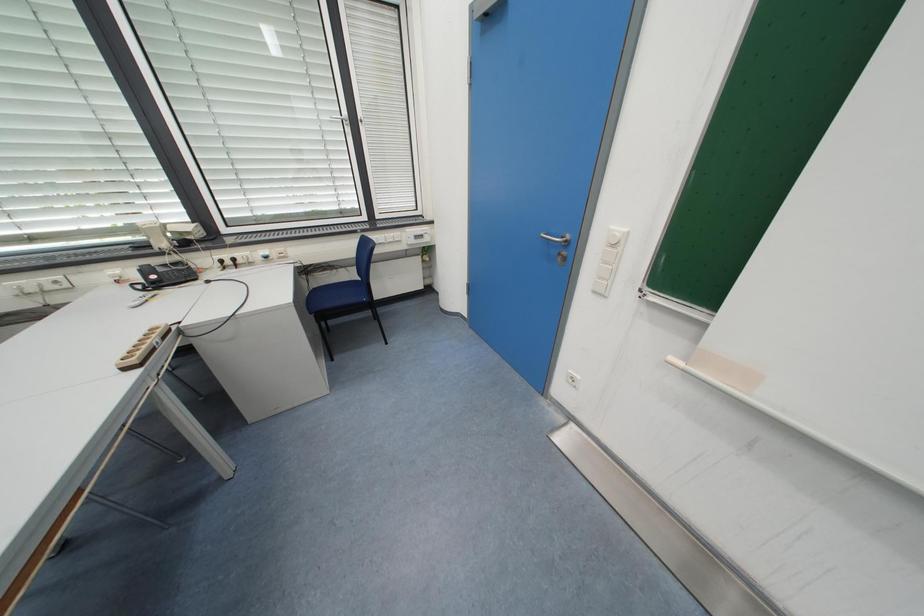
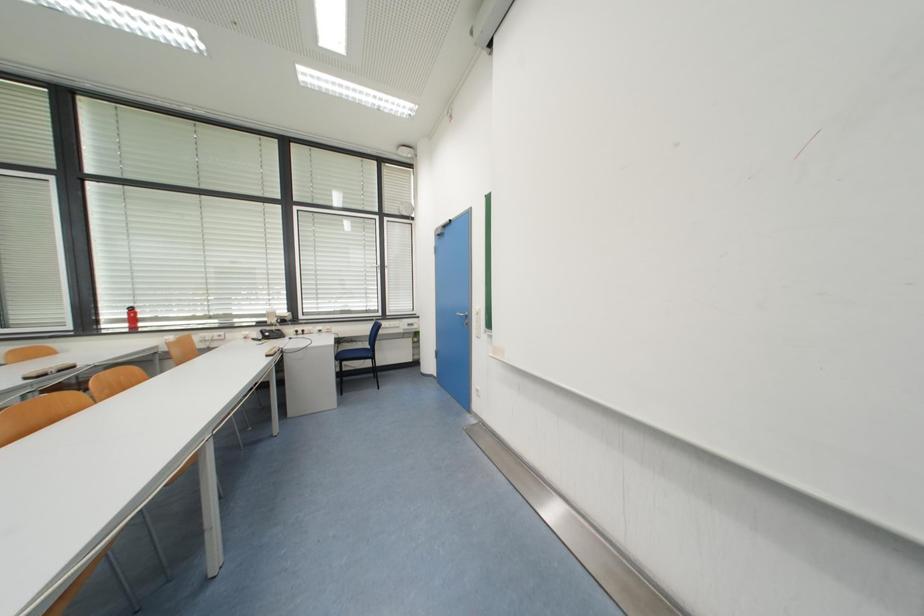
What movement of the cameraman would produce the second image?

The movement direction of the cameraman is right, backward.